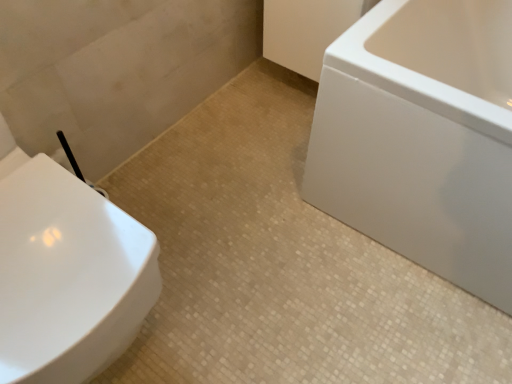
This screenshot has height=384, width=512. I want to click on free space between white glossy toilet at left and white glossy bathtub at right, so click(x=281, y=260).